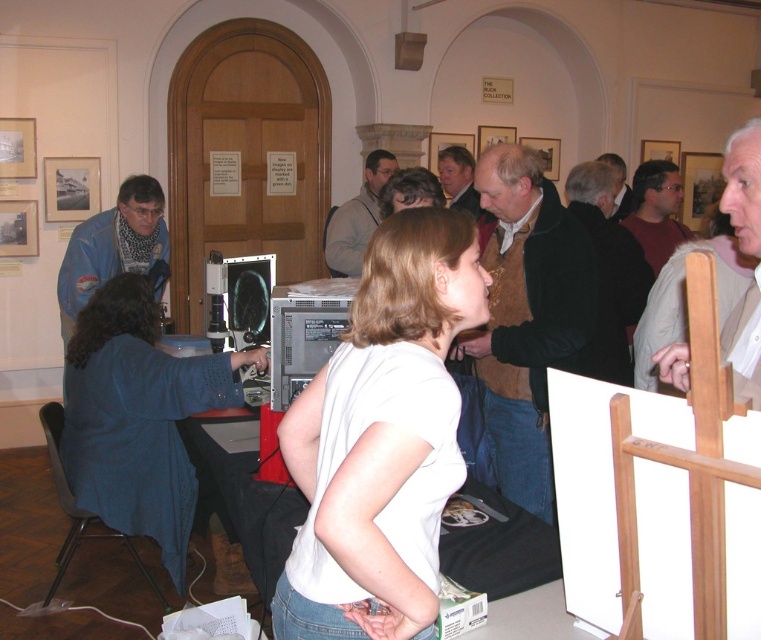
Looking at this image, between white matte shirt at center and blue sweater at left, which one appears on the left side from the viewer's perspective?

Positioned to the left is blue sweater at left.

Who is more distant from viewer, (368,298) or (180,468)?

Point (180,468)

Identify the location of white matte shirt at center. (381, 438).